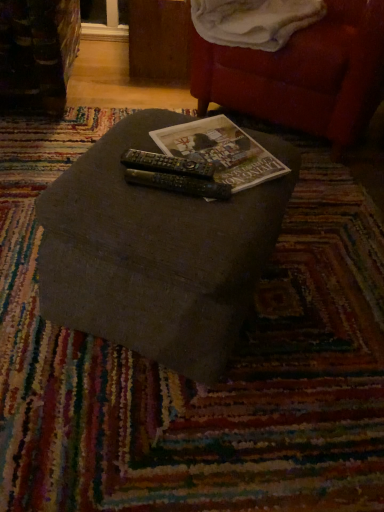
I want to click on free point above matte paper book at center (from a real-world perspective), so click(221, 145).